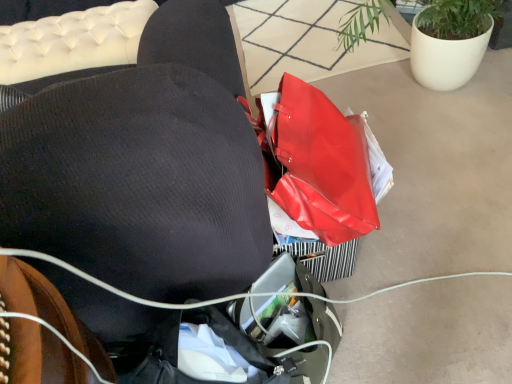
Question: Does matte white pot at upper right appear on the right side of black fabric bean bag chair at center?

Choices:
 (A) no
 (B) yes

Answer: (B)

Question: Is matte white pot at upper right shorter than black fabric bean bag chair at center?

Choices:
 (A) no
 (B) yes

Answer: (B)

Question: Is matte white pot at upper right positioned beyond the bounds of black fabric bean bag chair at center?

Choices:
 (A) yes
 (B) no

Answer: (A)

Question: Is matte white pot at upper right taller than black fabric bean bag chair at center?

Choices:
 (A) yes
 (B) no

Answer: (B)

Question: From a real-world perspective, is matte white pot at upper right under black fabric bean bag chair at center?

Choices:
 (A) yes
 (B) no

Answer: (A)

Question: Is matte white pot at upper right looking in the opposite direction of black fabric bean bag chair at center?

Choices:
 (A) yes
 (B) no

Answer: (B)

Question: Is black fabric bean bag chair at center directly adjacent to matte white pot at upper right?

Choices:
 (A) no
 (B) yes

Answer: (A)

Question: From a real-world perspective, is black fabric bean bag chair at center located beneath matte white pot at upper right?

Choices:
 (A) yes
 (B) no

Answer: (B)

Question: From the image's perspective, does black fabric bean bag chair at center appear lower than matte white pot at upper right?

Choices:
 (A) yes
 (B) no

Answer: (A)

Question: Is black fabric bean bag chair at center thinner than matte white pot at upper right?

Choices:
 (A) yes
 (B) no

Answer: (B)

Question: Does black fabric bean bag chair at center come behind matte white pot at upper right?

Choices:
 (A) yes
 (B) no

Answer: (B)

Question: Is black fabric bean bag chair at center oriented away from matte white pot at upper right?

Choices:
 (A) no
 (B) yes

Answer: (A)

Question: Considering their positions, is black fabric bean bag chair at center located in front of or behind matte white pot at upper right?

Choices:
 (A) front
 (B) behind

Answer: (A)